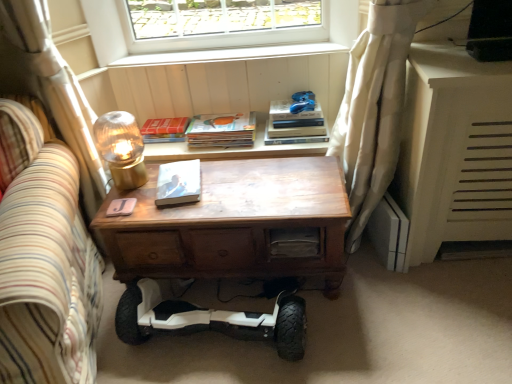
You are a GUI agent. You are given a task and a screenshot of the screen. Output one action in this format:
    pyautogui.click(x=<x>, y=<y>)
    Task: Click on the vacant point above hardcover books at upper right (from a real-world perspective)
    
    Given the screenshot: What is the action you would take?
    pyautogui.click(x=291, y=111)